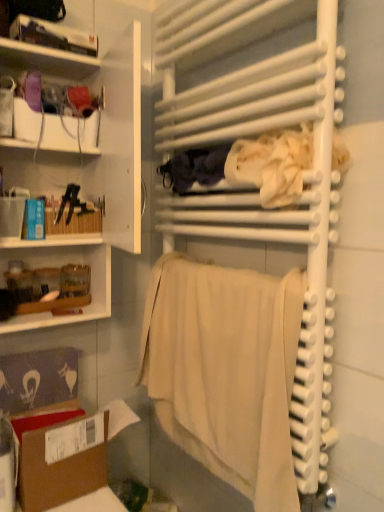
What is the approximate height of matte white box at upper left?

matte white box at upper left is 11.34 centimeters in height.

How much space does dark blue fabric at center, the second clothing when ordered from right to left, occupy vertically?

dark blue fabric at center, the second clothing when ordered from right to left, is 4.16 inches in height.

Image resolution: width=384 pixels, height=512 pixels. Describe the element at coordinates (249, 286) in the screenshot. I see `white matte towel rack at center` at that location.

At what (x,y) coordinates should I click in order to perform the action: click on matte white box at upper left. Please return your answer as a coordinate pair (x, y). The width and height of the screenshot is (384, 512). Looking at the image, I should click on (55, 129).

From a real-world perspective, is white matte cabinet at left, placed as the 1th shelf when sorted from bottom to top, located higher than dark blue fabric at center, the second clothing when ordered from right to left?

Actually, white matte cabinet at left, placed as the 1th shelf when sorted from bottom to top, is physically below dark blue fabric at center, the second clothing when ordered from right to left, in the real world.

Considering the positions of points (125, 95) and (177, 191), is point (125, 95) closer to camera compared to point (177, 191)?

Yes.

Considering the positions of objects white matte cabinet at left, placed as the 1th shelf when sorted from bottom to top, and dark blue fabric at center, which appears as the 1th clothing when viewed from the left, in the image provided, who is more to the right, white matte cabinet at left, placed as the 1th shelf when sorted from bottom to top, or dark blue fabric at center, which appears as the 1th clothing when viewed from the left,?

dark blue fabric at center, which appears as the 1th clothing when viewed from the left, is more to the right.

Locate an element on the screen. The width and height of the screenshot is (384, 512). clothing that is the 2nd object located behind the white matte cabinet at left, placed as the 1th shelf when sorted from bottom to top is located at coordinates (194, 168).

Is dark blue fabric at center, which appears as the 1th clothing when viewed from the left, directly adjacent to white glossy bookshelf at upper left, which ranks as the second shelf in bottom-to-top order?

No, dark blue fabric at center, which appears as the 1th clothing when viewed from the left, is not touching white glossy bookshelf at upper left, which ranks as the second shelf in bottom-to-top order.

Where is `the 2nd shelf to the left of the dark blue fabric at center, which appears as the 1th clothing when viewed from the left, starting your count from the anchor`? This screenshot has width=384, height=512. the 2nd shelf to the left of the dark blue fabric at center, which appears as the 1th clothing when viewed from the left, starting your count from the anchor is located at coordinates (53, 36).

From a real-world perspective, between dark blue fabric at center, the second clothing when ordered from right to left, and white glossy bookshelf at upper left, the first shelf from the top, who is vertically higher?

From a 3D spatial view, white glossy bookshelf at upper left, the first shelf from the top, is above.

Does brown cardboard box at lower left have a greater height compared to white fabric at center, which ranks as the 2th clothing in left-to-right order?

Yes.

From the image's perspective, is brown cardboard box at lower left located above or below white fabric at center, positioned as the first clothing in right-to-left order?

Clearly, from the image's perspective, brown cardboard box at lower left is below white fabric at center, positioned as the first clothing in right-to-left order.

Which of these two, brown cardboard box at lower left or white fabric at center, positioned as the first clothing in right-to-left order, is wider?

Wider between the two is brown cardboard box at lower left.

From a real-world perspective, which is physically below, brown cardboard box at lower left or white fabric at center, positioned as the first clothing in right-to-left order?

From a 3D spatial view, brown cardboard box at lower left is below.

From the image's perspective, which object appears higher, brown cardboard box at lower left or white matte cabinet at left, placed as the 1th shelf when sorted from bottom to top?

white matte cabinet at left, placed as the 1th shelf when sorted from bottom to top, appears higher in the image.

Is brown cardboard box at lower left oriented away from white matte cabinet at left, placed as the 1th shelf when sorted from bottom to top?

brown cardboard box at lower left does not have its back to white matte cabinet at left, placed as the 1th shelf when sorted from bottom to top.

Between brown cardboard box at lower left and white matte cabinet at left, placed as the 1th shelf when sorted from bottom to top, which one appears on the left side from the viewer's perspective?

From the viewer's perspective, white matte cabinet at left, placed as the 1th shelf when sorted from bottom to top, appears more on the left side.

Is there a large distance between white fabric at center, positioned as the first clothing in right-to-left order, and matte white box at upper left?

No.

From the image's perspective, which object appears higher, white fabric at center, positioned as the first clothing in right-to-left order, or matte white box at upper left?

matte white box at upper left.

Which is behind, point (287, 196) or point (94, 130)?

Positioned behind is point (94, 130).

Can you tell me how much white fabric at center, positioned as the first clothing in right-to-left order, and matte white box at upper left differ in facing direction?

white fabric at center, positioned as the first clothing in right-to-left order, and matte white box at upper left are facing 90.8 degrees away from each other.

Based on their sizes in the image, would you say white matte towel rack at center is bigger or smaller than white fabric at center, positioned as the first clothing in right-to-left order?

white matte towel rack at center is bigger than white fabric at center, positioned as the first clothing in right-to-left order.

Which clothing is the 1st one when counting from the back of the white matte towel rack at center? Please provide its 2D coordinates.

[(248, 166)]

Who is shorter, white matte towel rack at center or white fabric at center, which ranks as the 2th clothing in left-to-right order?

white fabric at center, which ranks as the 2th clothing in left-to-right order, is shorter.

Do you think white matte towel rack at center is within white fabric at center, positioned as the first clothing in right-to-left order, or outside of it?

white matte towel rack at center lies outside white fabric at center, positioned as the first clothing in right-to-left order.

Can we say dark blue fabric at center, the second clothing when ordered from right to left, lies outside white matte towel rack at center?

Actually, dark blue fabric at center, the second clothing when ordered from right to left, is at least partially inside white matte towel rack at center.

Based on their sizes in the image, would you say dark blue fabric at center, which appears as the 1th clothing when viewed from the left, is bigger or smaller than white matte towel rack at center?

Clearly, dark blue fabric at center, which appears as the 1th clothing when viewed from the left, is smaller in size than white matte towel rack at center.

Is dark blue fabric at center, the second clothing when ordered from right to left, in contact with white matte towel rack at center?

dark blue fabric at center, the second clothing when ordered from right to left, and white matte towel rack at center are not in contact.

From their relative heights in the image, would you say dark blue fabric at center, which appears as the 1th clothing when viewed from the left, is taller or shorter than white matte towel rack at center?

Considering their sizes, dark blue fabric at center, which appears as the 1th clothing when viewed from the left, has less height than white matte towel rack at center.

The image size is (384, 512). Identify the location of clothing that is the 2nd one when counting upward from the white matte cabinet at left, placed as the second shelf when sorted from top to bottom (from the image's perspective). (194, 168).

You are a GUI agent. You are given a task and a screenshot of the screen. Output one action in this format:
    pyautogui.click(x=<x>, y=<y>)
    Task: Click on the shelf above the dark blue fabric at center, which appears as the 1th clothing when viewed from the left (from a real-world perspective)
    This screenshot has width=384, height=512.
    Given the screenshot: What is the action you would take?
    tap(53, 36)

Which object lies nearer to the anchor point brown cardboard box at lower left, beige cotton towel at center or dark blue fabric at center, which appears as the 1th clothing when viewed from the left?

Among the two, beige cotton towel at center is located nearer to brown cardboard box at lower left.

Estimate the real-world distances between objects in this image. Which object is closer to white glossy bookshelf at upper left, the first shelf from the top, matte white box at upper left or white fabric at center, which ranks as the 2th clothing in left-to-right order?

The object closer to white glossy bookshelf at upper left, the first shelf from the top, is matte white box at upper left.

Estimate the real-world distances between objects in this image. Which object is closer to white matte towel rack at center, white glossy bookshelf at upper left, the first shelf from the top, or white fabric at center, positioned as the first clothing in right-to-left order?

white fabric at center, positioned as the first clothing in right-to-left order.

From the image, which object appears to be nearer to white matte cabinet at left, placed as the 1th shelf when sorted from bottom to top, white fabric at center, positioned as the first clothing in right-to-left order, or brown cardboard box at lower left?

white fabric at center, positioned as the first clothing in right-to-left order, is positioned closer to the anchor white matte cabinet at left, placed as the 1th shelf when sorted from bottom to top.

Looking at the image, which one is located closer to white matte towel rack at center, matte white box at upper left or white matte cabinet at left, placed as the second shelf when sorted from top to bottom?

white matte cabinet at left, placed as the second shelf when sorted from top to bottom, is positioned closer to the anchor white matte towel rack at center.

Which object lies further to the anchor point white fabric at center, which ranks as the 2th clothing in left-to-right order, brown cardboard box at lower left or white matte towel rack at center?

brown cardboard box at lower left lies further to white fabric at center, which ranks as the 2th clothing in left-to-right order, than the other object.

Considering their positions, is brown cardboard box at lower left positioned further to white matte cabinet at left, placed as the second shelf when sorted from top to bottom, than dark blue fabric at center, the second clothing when ordered from right to left?

brown cardboard box at lower left lies further to white matte cabinet at left, placed as the second shelf when sorted from top to bottom, than the other object.

Considering their positions, is white matte cabinet at left, placed as the second shelf when sorted from top to bottom, positioned closer to white glossy bookshelf at upper left, which ranks as the second shelf in bottom-to-top order, than brown cardboard box at lower left?

Among the two, white matte cabinet at left, placed as the second shelf when sorted from top to bottom, is located nearer to white glossy bookshelf at upper left, which ranks as the second shelf in bottom-to-top order.

Locate an element on the screen. The height and width of the screenshot is (512, 384). shelf between white glossy bookshelf at upper left, the first shelf from the top, and white matte towel rack at center vertically is located at coordinates (82, 170).

Where is `clothing between white matte towel rack at center and dark blue fabric at center, which appears as the 1th clothing when viewed from the left, in the front-back direction`? clothing between white matte towel rack at center and dark blue fabric at center, which appears as the 1th clothing when viewed from the left, in the front-back direction is located at coordinates (248, 166).

Find the location of a particular element. This screenshot has height=512, width=384. shelf that lies between white fabric at center, which ranks as the 2th clothing in left-to-right order, and beige cotton towel at center from top to bottom is located at coordinates (82, 170).

Locate an element on the screen. This screenshot has width=384, height=512. closet that lies between white glossy bookshelf at upper left, the first shelf from the top, and brown cardboard box at lower left from top to bottom is located at coordinates (249, 286).